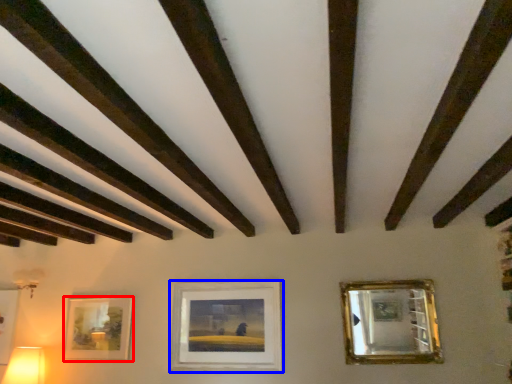
Question: Which point is further to the camera, picture frame (highlighted by a red box) or picture frame (highlighted by a blue box)?

Choices:
 (A) picture frame
 (B) picture frame

Answer: (A)